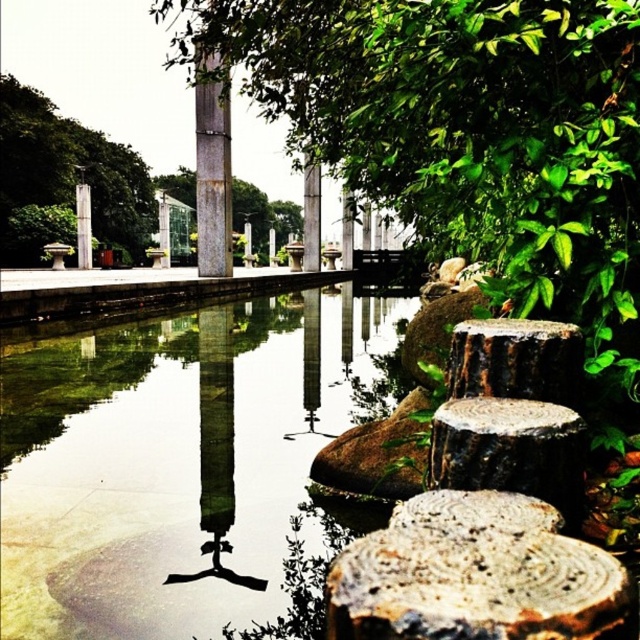
In the scene shown: You are an observer standing in front of the water body. You notice the rusty metal pole at center and the rustic wooden post at center. Which object is positioned lower in the scene?

The rusty metal pole at center is below the rustic wooden post at center, so the rusty metal pole at center is positioned lower in the scene.